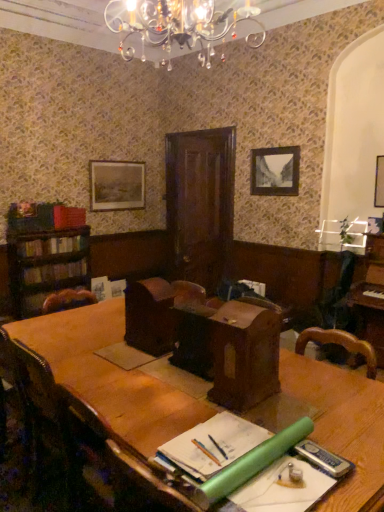
Question: Is wooden picture frame at upper left, which is the third picture frame from front to back, looking in the opposite direction of wooden table at center?

Choices:
 (A) no
 (B) yes

Answer: (A)

Question: Considering the relative sizes of wooden picture frame at upper left, which is counted as the 1th picture frame, starting from the left, and wooden table at center in the image provided, is wooden picture frame at upper left, which is counted as the 1th picture frame, starting from the left, shorter than wooden table at center?

Choices:
 (A) yes
 (B) no

Answer: (A)

Question: Is the position of wooden picture frame at upper left, the third picture frame positioned from the right, more distant than that of wooden table at center?

Choices:
 (A) no
 (B) yes

Answer: (B)

Question: Can you confirm if wooden picture frame at upper left, marked as the first picture frame in a back-to-front arrangement, is taller than wooden table at center?

Choices:
 (A) yes
 (B) no

Answer: (B)

Question: From the image's perspective, is wooden picture frame at upper left, which is counted as the 1th picture frame, starting from the left, located above wooden table at center?

Choices:
 (A) no
 (B) yes

Answer: (B)

Question: Can you confirm if brown leather armchair at center, which appears as the first armchair when viewed from the right, is bigger than dark brown leather bookshelf at left, arranged as the third book when viewed from the top?

Choices:
 (A) yes
 (B) no

Answer: (B)

Question: From a real-world perspective, is brown leather armchair at center, which is the 2th armchair in left-to-right order, over dark brown leather bookshelf at left, placed as the first book when sorted from bottom to top?

Choices:
 (A) no
 (B) yes

Answer: (B)

Question: Does brown leather armchair at center, which appears as the first armchair when viewed from the right, have a greater height compared to dark brown leather bookshelf at left, placed as the first book when sorted from bottom to top?

Choices:
 (A) yes
 (B) no

Answer: (A)

Question: Is brown leather armchair at center, which appears as the first armchair when viewed from the right, oriented towards dark brown leather bookshelf at left, arranged as the third book when viewed from the top?

Choices:
 (A) yes
 (B) no

Answer: (B)

Question: Is brown leather armchair at center, which is the 2th armchair in left-to-right order, facing away from dark brown leather bookshelf at left, placed as the first book when sorted from bottom to top?

Choices:
 (A) no
 (B) yes

Answer: (A)

Question: From the image's perspective, is brown leather armchair at center, which appears as the first armchair when viewed from the right, on top of dark brown leather bookshelf at left, placed as the first book when sorted from bottom to top?

Choices:
 (A) no
 (B) yes

Answer: (A)

Question: Is matte red bookshelf at left, which is counted as the first book, starting from the top, not inside hardcover books at left, the second book from the top?

Choices:
 (A) yes
 (B) no

Answer: (A)